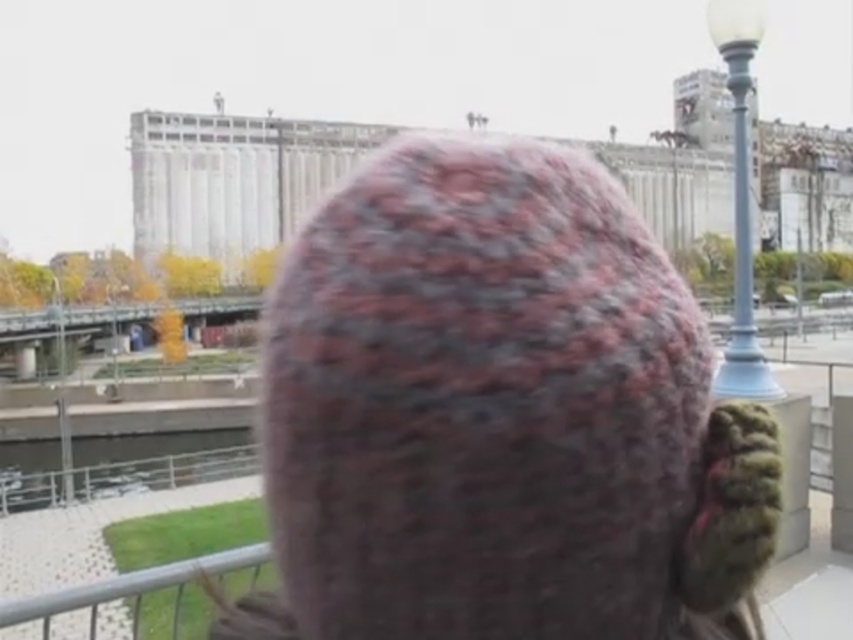
Between clear water at lower left and light blue glass lamp post at upper right, which one appears on the left side from the viewer's perspective?

clear water at lower left

Can you confirm if clear water at lower left is positioned above light blue glass lamp post at upper right?

No, clear water at lower left is not above light blue glass lamp post at upper right.

Who is more distant from viewer, (115, 484) or (735, 371)?

The point (115, 484) is more distant.

At what (x,y) coordinates should I click in order to perform the action: click on clear water at lower left. Please return your answer as a coordinate pair (x, y). Looking at the image, I should click on pos(161,460).

From the picture: Who is positioned more to the left, knitted woolen hat at center or clear water at lower left?

Positioned to the left is clear water at lower left.

Is knitted woolen hat at center closer to camera compared to clear water at lower left?

Yes, it is.

The height and width of the screenshot is (640, 853). Find the location of `knitted woolen hat at center`. knitted woolen hat at center is located at coordinates (500, 410).

Is point (149, 464) positioned before point (83, 582)?

No, it is behind (83, 582).

Between clear water at lower left and metallic silver rail at lower left, which one is positioned higher?

Positioned higher is metallic silver rail at lower left.

What do you see at coordinates (161, 460) in the screenshot? I see `clear water at lower left` at bounding box center [161, 460].

Locate an element on the screen. clear water at lower left is located at coordinates (161, 460).